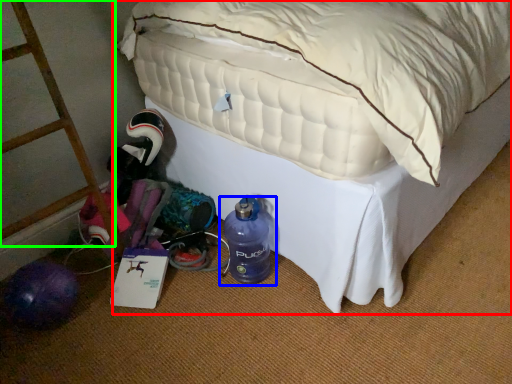
Question: Estimate the real-world distances between objects in this image. Which object is closer to bed (highlighted by a red box), bottle (highlighted by a blue box) or ladder (highlighted by a green box)?

Choices:
 (A) bottle
 (B) ladder

Answer: (A)